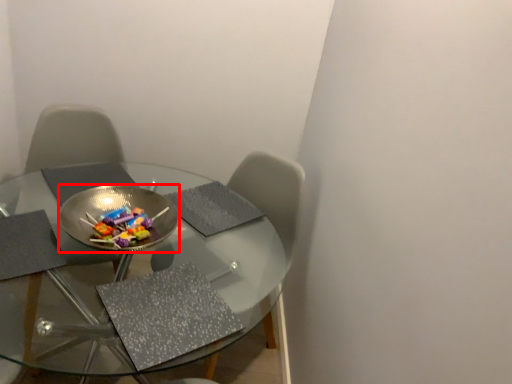
Question: Where is bowl (annotated by the red box) located in relation to table in the image?

Choices:
 (A) right
 (B) left

Answer: (A)